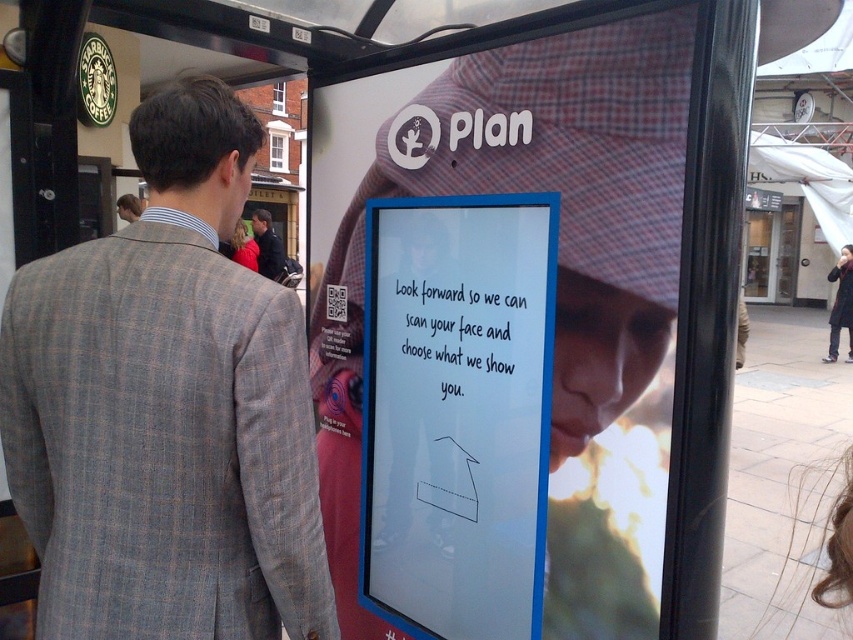
Is brown hair at lower right thinner than light brown hair at upper left?

Yes, brown hair at lower right is thinner than light brown hair at upper left.

Which is in front, point (770, 602) or point (119, 214)?

Positioned in front is point (770, 602).

Which is behind, point (846, 604) or point (120, 209)?

The point (120, 209) is behind.

Image resolution: width=853 pixels, height=640 pixels. I want to click on brown hair at lower right, so click(819, 545).

Which is in front, point (241, 243) or point (138, 209)?

Point (138, 209)

From the picture: Measure the distance between red fleece jacket at center and light brown hair at upper left.

red fleece jacket at center is 3.46 feet from light brown hair at upper left.

Does point (238, 237) come closer to viewer compared to point (125, 195)?

No.

Locate an element on the screen. This screenshot has width=853, height=640. red fleece jacket at center is located at coordinates (242, 246).

Is the position of white glossy screen at center less distant than that of dark blue jacket at center?

Yes, white glossy screen at center is closer to the viewer.

Between white glossy screen at center and dark blue jacket at center, which one appears on the left side from the viewer's perspective?

Positioned to the left is dark blue jacket at center.

Does point (496, 458) lie behind point (260, 227)?

No, it is not.

Find the location of a particular element. The width and height of the screenshot is (853, 640). white glossy screen at center is located at coordinates (457, 412).